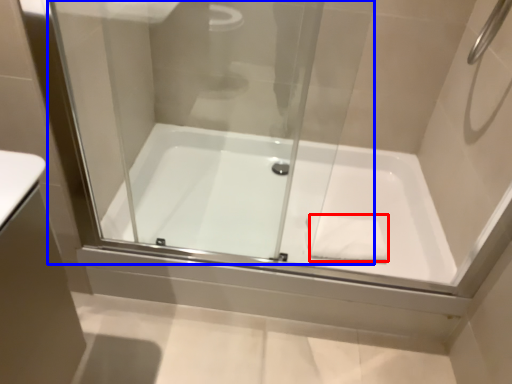
Question: Among these objects, which one is farthest to the camera, hand towel (highlighted by a red box) or glass door (highlighted by a blue box)?

Choices:
 (A) hand towel
 (B) glass door

Answer: (A)